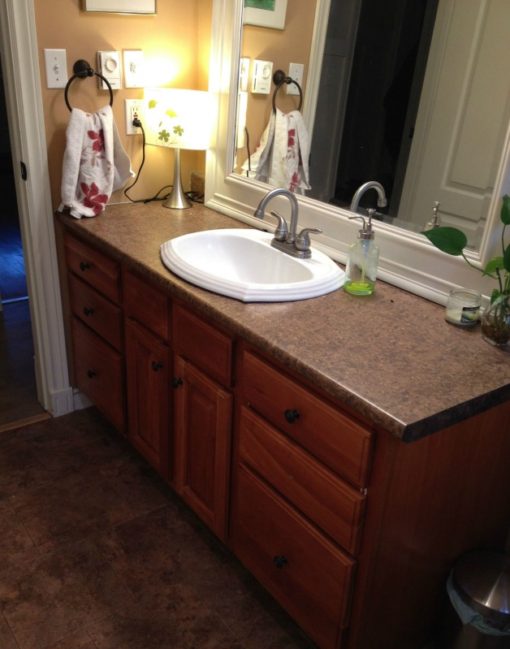
The image size is (510, 649). In order to click on faucet in this screenshot , I will do `click(272, 191)`.